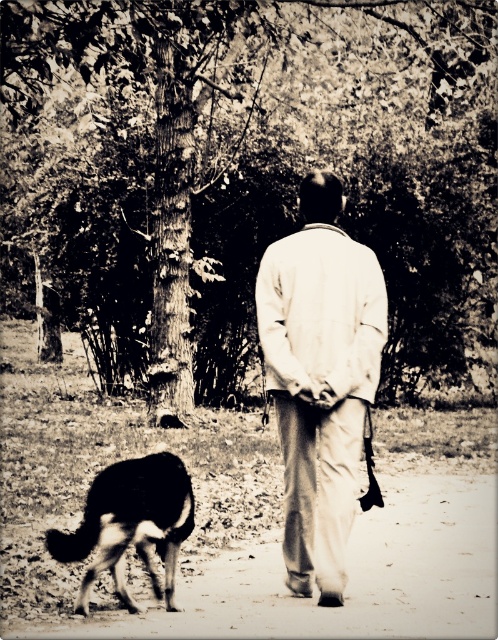
Which is more to the left, white cotton shirt at center or black fur dog at lower left?

black fur dog at lower left is more to the left.

Who is taller, white cotton shirt at center or black fur dog at lower left?

Standing taller between the two is white cotton shirt at center.

Who is more forward, (257, 284) or (45, 545)?

Point (257, 284) is in front.

Where is `white cotton shirt at center`? white cotton shirt at center is located at coordinates click(320, 378).